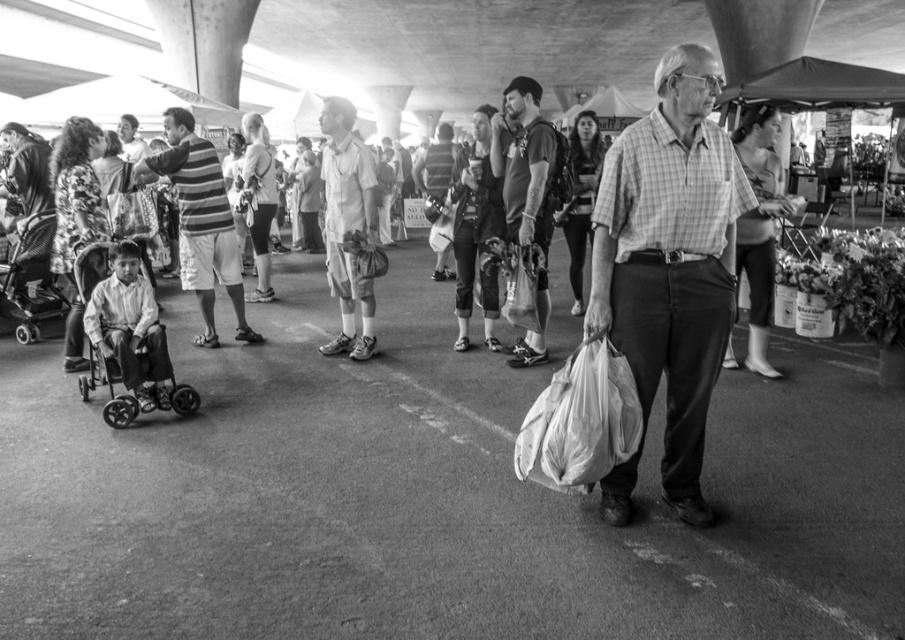
How far apart are dark gray t-shirt at center and plastic baby carriage at left?

16.81 feet

Is point (550, 228) farther from viewer compared to point (35, 298)?

No.

Which is behind, point (532, 212) or point (26, 291)?

The point (26, 291) is more distant.

The height and width of the screenshot is (640, 905). Find the location of `dark gray t-shirt at center`. dark gray t-shirt at center is located at coordinates (526, 195).

Consider the image. Does matte white plastic bag at center have a smaller size compared to striped fabric shirt at center?

Indeed, matte white plastic bag at center has a smaller size compared to striped fabric shirt at center.

Does point (707, 508) come behind point (184, 272)?

No, (707, 508) is closer to viewer.

This screenshot has width=905, height=640. Find the location of `matte white plastic bag at center`. matte white plastic bag at center is located at coordinates [670, 259].

Does point (691, 236) lie in front of point (541, 136)?

That is True.

Locate an element on the screen. matte white plastic bag at center is located at coordinates click(670, 259).

You are a GUI agent. You are given a task and a screenshot of the screen. Output one action in this format:
    pyautogui.click(x=<x>, y=<y>)
    Task: Click on the matte white plastic bag at center
    This screenshot has width=905, height=640.
    Given the screenshot: What is the action you would take?
    pyautogui.click(x=670, y=259)